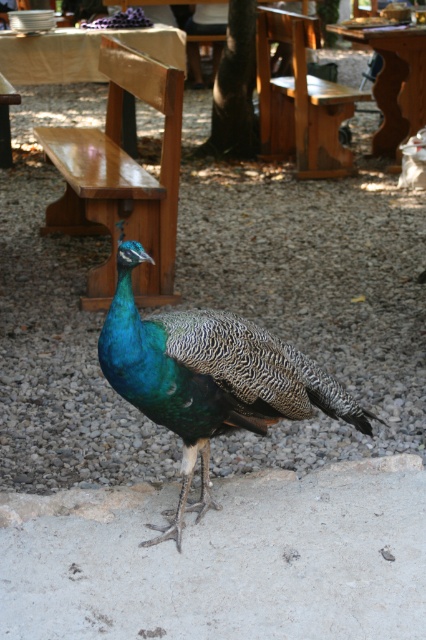
Question: Is shiny wood bench at center closer to camera compared to wooden park bench at center?

Choices:
 (A) no
 (B) yes

Answer: (B)

Question: Which point appears closest to the camera in this image?

Choices:
 (A) (60, 314)
 (B) (276, 100)

Answer: (A)

Question: Does shiny wood bench at center appear over wooden park bench at center?

Choices:
 (A) no
 (B) yes

Answer: (A)

Question: Does shiny blue peacock at center appear under wooden park bench at center?

Choices:
 (A) yes
 (B) no

Answer: (A)

Question: Based on their relative distances, which object is nearer to the shiny blue peacock at center?

Choices:
 (A) wooden picnic table at center
 (B) gray gravel at center

Answer: (B)

Question: Based on their relative distances, which object is nearer to the shiny wood bench at center?

Choices:
 (A) shiny blue peacock at center
 (B) wooden picnic table at center

Answer: (A)